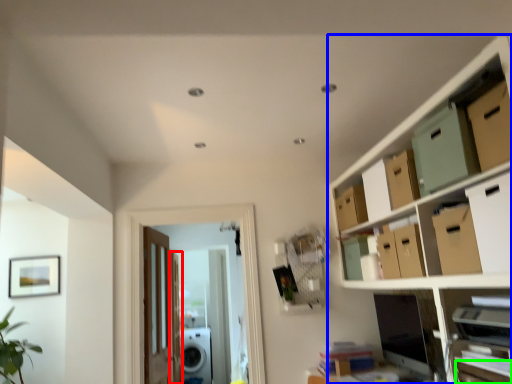
Question: Estimate the real-world distances between objects in this image. Which object is farther from door (highlighted by a red box), cabinetry (highlighted by a blue box) or drawer (highlighted by a green box)?

Choices:
 (A) cabinetry
 (B) drawer

Answer: (B)